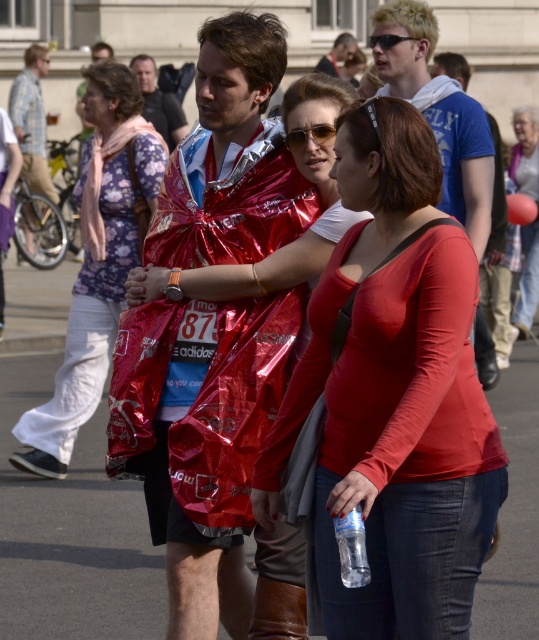
Looking at the scene, where is the matte red shirt at center in relation to the matte plastic bag at center?

The matte red shirt at center is to the left of the matte plastic bag at center.

You are organizing a charity event and need to choose between the shiny plastic bag at center and the matte red raincoat at center to display promotional materials. Which item can accommodate a larger poster?

The shiny plastic bag at center has a larger size compared to the matte red raincoat at center, so it can accommodate a larger poster.